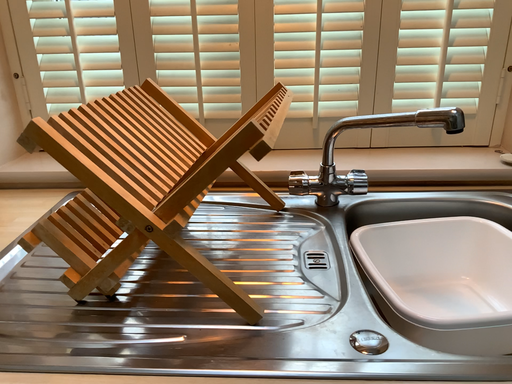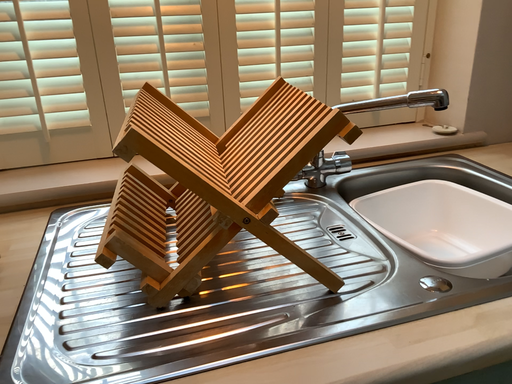
Question: Which way did the camera rotate in the video?

Choices:
 (A) rotated right
 (B) rotated left

Answer: (A)